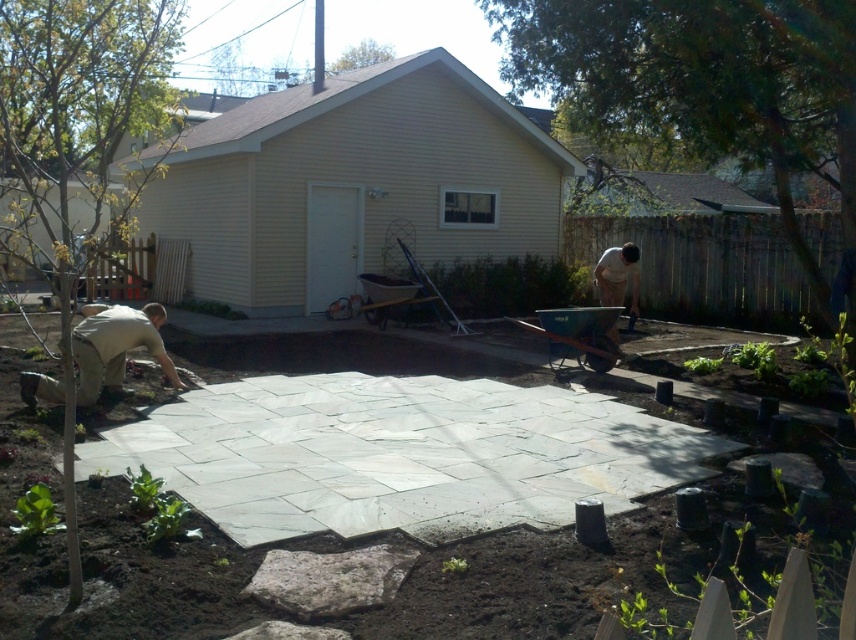
Between natural stone patio at center and light brown wood shovel at right, which one appears on the right side from the viewer's perspective?

light brown wood shovel at right is more to the right.

Does point (294, 531) come in front of point (610, 252)?

Yes.

Identify the location of natural stone patio at center. The height and width of the screenshot is (640, 856). (400, 454).

Is natural stone patio at center positioned before tan/rough fabric man at lower left?

Yes.

Is point (702, 470) positioned after point (22, 401)?

No, (702, 470) is in front of (22, 401).

Describe the element at coordinates (400, 454) in the screenshot. I see `natural stone patio at center` at that location.

Identify the location of natural stone patio at center. (400, 454).

Can you confirm if tan/rough fabric man at lower left is smaller than light brown wood shovel at right?

No, tan/rough fabric man at lower left is not smaller than light brown wood shovel at right.

From the picture: Can you confirm if tan/rough fabric man at lower left is positioned below light brown wood shovel at right?

Indeed, tan/rough fabric man at lower left is positioned under light brown wood shovel at right.

Where is `tan/rough fabric man at lower left`? The height and width of the screenshot is (640, 856). tan/rough fabric man at lower left is located at coordinates [x=116, y=348].

The height and width of the screenshot is (640, 856). I want to click on tan/rough fabric man at lower left, so click(116, 348).